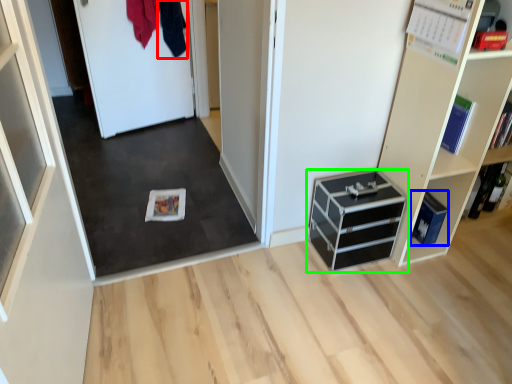
Question: Based on their relative distances, which object is farther from clothing (highlighted by a red box)? Choose from cabinetry (highlighted by a blue box) and chest of drawers (highlighted by a green box).

Choices:
 (A) cabinetry
 (B) chest of drawers

Answer: (A)